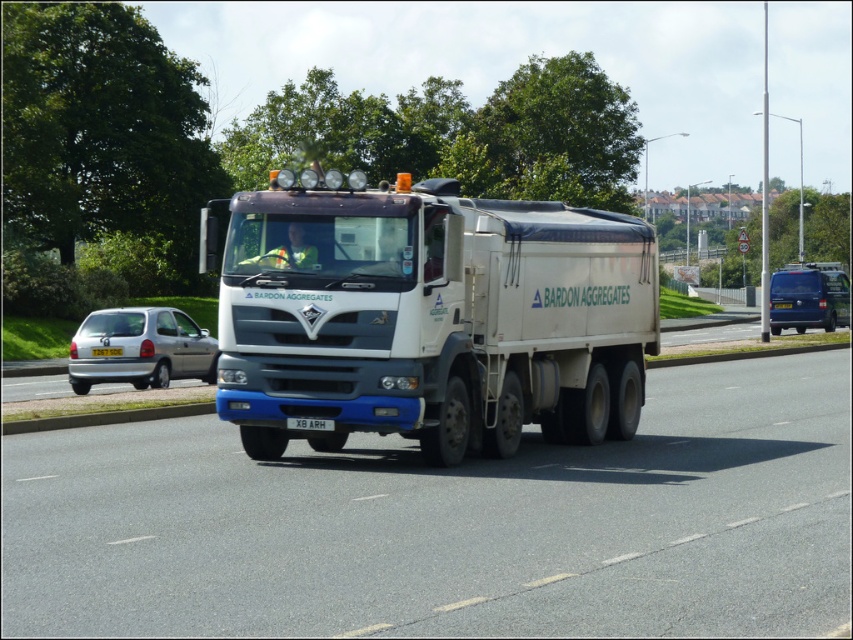
Question: Is white rubber asphalt road at center positioned behind yellow plastic license plate at center?

Choices:
 (A) no
 (B) yes

Answer: (A)

Question: Among these points, which one is farthest from the camera?

Choices:
 (A) [x=132, y=602]
 (B) [x=120, y=353]

Answer: (B)

Question: Is white matte trailer truck at center in front of yellow plastic license plate at center?

Choices:
 (A) yes
 (B) no

Answer: (A)

Question: Which object appears closest to the camera in this image?

Choices:
 (A) silver metallic hatchback at left
 (B) white matte trailer truck at center

Answer: (B)

Question: Is white matte trailer truck at center positioned behind yellow plastic license plate at center?

Choices:
 (A) no
 (B) yes

Answer: (A)

Question: Which object appears farthest from the camera in this image?

Choices:
 (A) silver metallic hatchback at left
 (B) blue metallic van at right

Answer: (B)